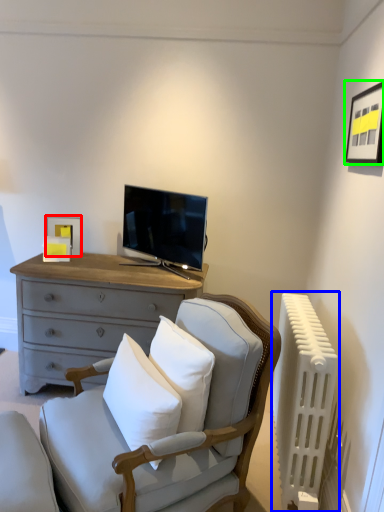
Question: Which object is positioned farthest from picture frame (highlighted by a red box)? Select from radiator (highlighted by a blue box) and picture frame (highlighted by a green box).

Choices:
 (A) radiator
 (B) picture frame

Answer: (B)